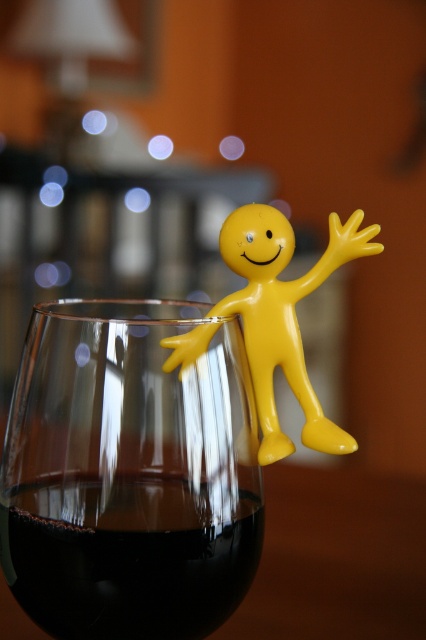
Question: From the image, what is the correct spatial relationship of dark glass at center in relation to yellow matte figure at upper right?

Choices:
 (A) left
 (B) right

Answer: (A)

Question: Which object appears closest to the camera in this image?

Choices:
 (A) transparent glass at upper center
 (B) yellow matte figure at upper right
 (C) dark glass at center

Answer: (C)

Question: Does transparent glass at upper center appear under yellow matte figure at upper right?

Choices:
 (A) no
 (B) yes

Answer: (B)

Question: Is dark glass at center behind yellow matte figure at upper right?

Choices:
 (A) yes
 (B) no

Answer: (B)

Question: Which point is farther to the camera?

Choices:
 (A) (166, 326)
 (B) (267, 216)
 (C) (100, 628)

Answer: (B)

Question: Among these points, which one is farthest from the camera?

Choices:
 (A) (244, 506)
 (B) (264, 372)
 (C) (229, 518)

Answer: (B)